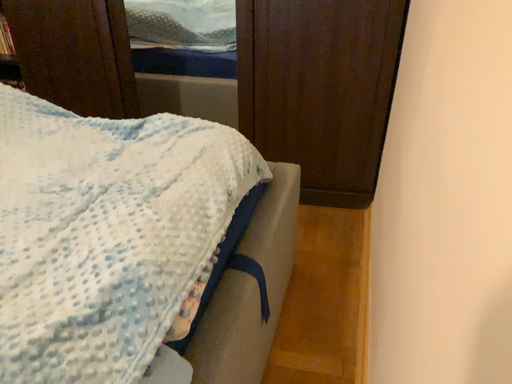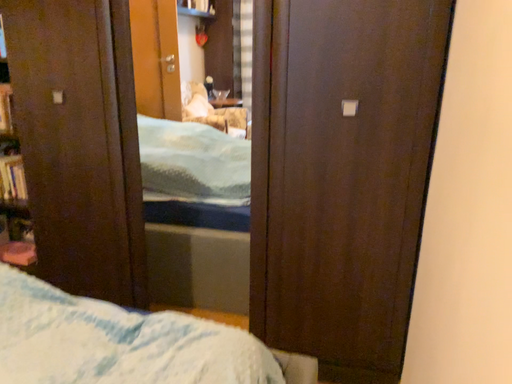
Question: How did the camera likely rotate when shooting the video?

Choices:
 (A) rotated downward
 (B) rotated upward

Answer: (B)